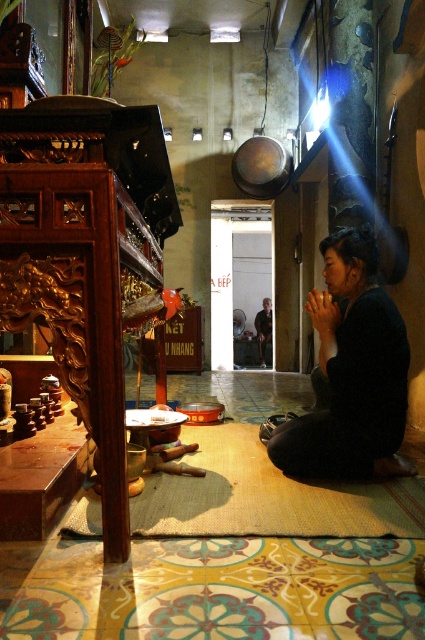
You are standing in the room and want to pick up both the black matte dress at lower right and the dark brown leather jacket at center. Which item should you reach for first to grab the one nearest to you?

The black matte dress at lower right is closer to the viewer than the dark brown leather jacket at center, so you should reach for the black matte dress at lower right first.

You are a tailor who needs to determine which garment has a greater width to fit a customer. Given the black matte dress at lower right and the dark brown leather jacket at center, which one is wider?

The black matte dress at lower right is wider than the dark brown leather jacket at center according to the description.